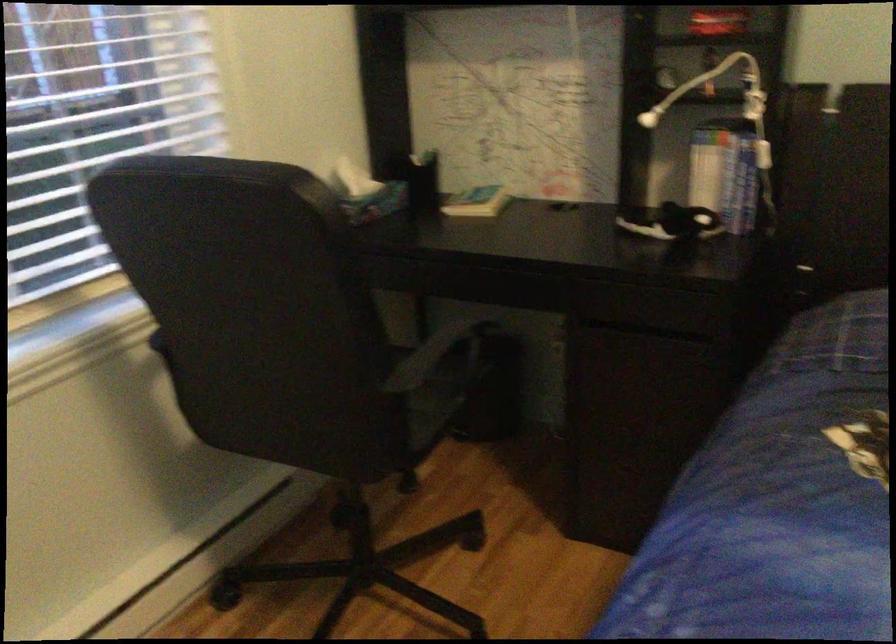
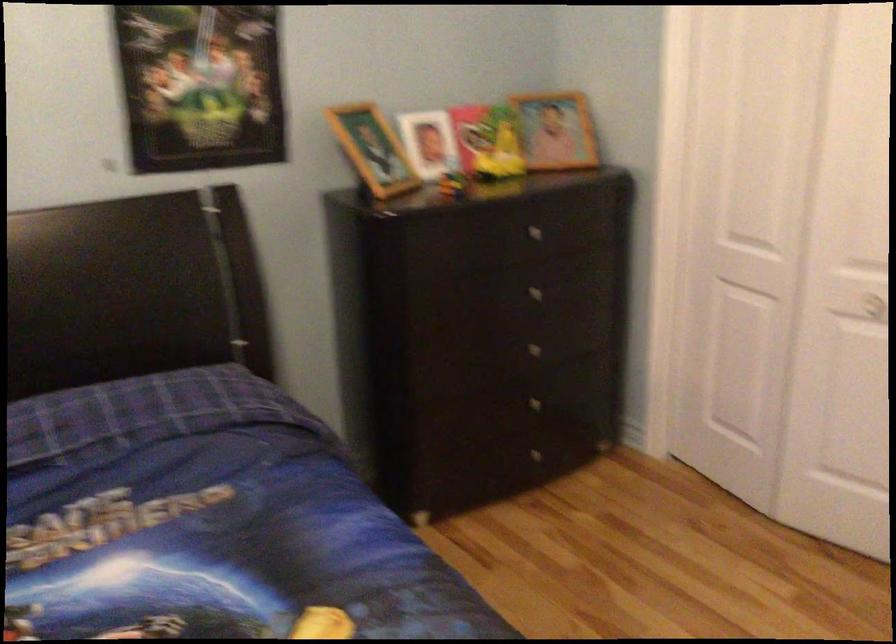
Question: The camera is either moving clockwise (left) or counter-clockwise (right) around the object. The first image is from the beginning of the video and the second image is from the end. Is the camera moving left or right when shooting the video?

Choices:
 (A) Left
 (B) Right

Answer: (A)